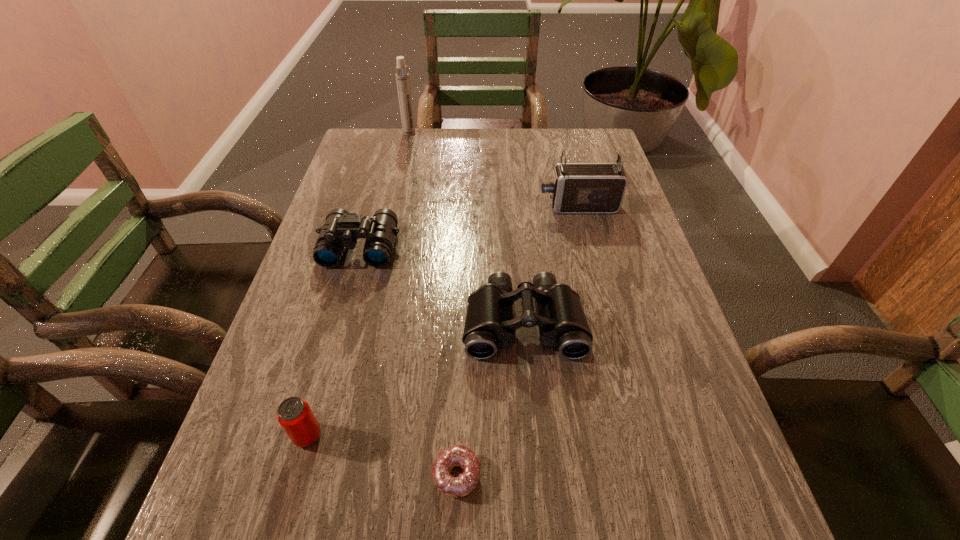
Locate an element on the screen. This screenshot has height=540, width=960. aerosol can present at the left edge is located at coordinates (402, 77).

Find the location of a particular element. This screenshot has height=540, width=960. binoculars that is at the left edge is located at coordinates pyautogui.click(x=341, y=229).

You are a GUI agent. You are given a task and a screenshot of the screen. Output one action in this format:
    pyautogui.click(x=<x>, y=<y>)
    Task: Click on the can located in the left edge section of the desktop
    This screenshot has width=960, height=540.
    Given the screenshot: What is the action you would take?
    pyautogui.click(x=294, y=414)

Locate an element on the screen. Image resolution: width=960 pixels, height=540 pixels. object that is at the right edge is located at coordinates (577, 188).

Identify the location of object situated at the far left corner. The height and width of the screenshot is (540, 960). (402, 77).

This screenshot has width=960, height=540. I want to click on vacant space at the far edge, so click(404, 140).

In the image, there is a desktop. Where is `free region at the left edge`? The width and height of the screenshot is (960, 540). free region at the left edge is located at coordinates pyautogui.click(x=324, y=333).

In the image, there is a desktop. In order to click on free region at the right edge in this screenshot , I will do `click(631, 251)`.

This screenshot has height=540, width=960. Identify the location of vacant space at the far left corner of the desktop. (357, 155).

In the image, there is a desktop. Where is `vacant space at the far right corner`? Image resolution: width=960 pixels, height=540 pixels. vacant space at the far right corner is located at coordinates (600, 160).